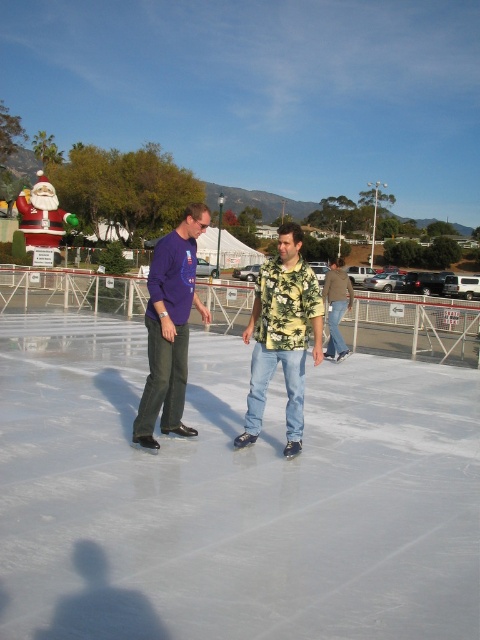
Question: Which point appears closest to the camera in this image?

Choices:
 (A) (288, 356)
 (B) (163, 406)

Answer: (A)

Question: Where is white smooth ice at center located in relation to matte purple shirt at center in the image?

Choices:
 (A) right
 (B) left

Answer: (A)

Question: Which object is farther from the camera taking this photo?

Choices:
 (A) matte purple shirt at center
 (B) yellow-green floral shirt at center
 (C) white smooth ice at center

Answer: (A)

Question: Which of the following is the closest to the observer?

Choices:
 (A) white smooth ice at center
 (B) yellow-green floral shirt at center
 (C) matte purple shirt at center

Answer: (A)

Question: Does white smooth ice at center have a lesser width compared to matte purple shirt at center?

Choices:
 (A) yes
 (B) no

Answer: (B)

Question: Observing the image, what is the correct spatial positioning of yellow-green floral shirt at center in reference to matte purple shirt at center?

Choices:
 (A) left
 (B) right

Answer: (B)